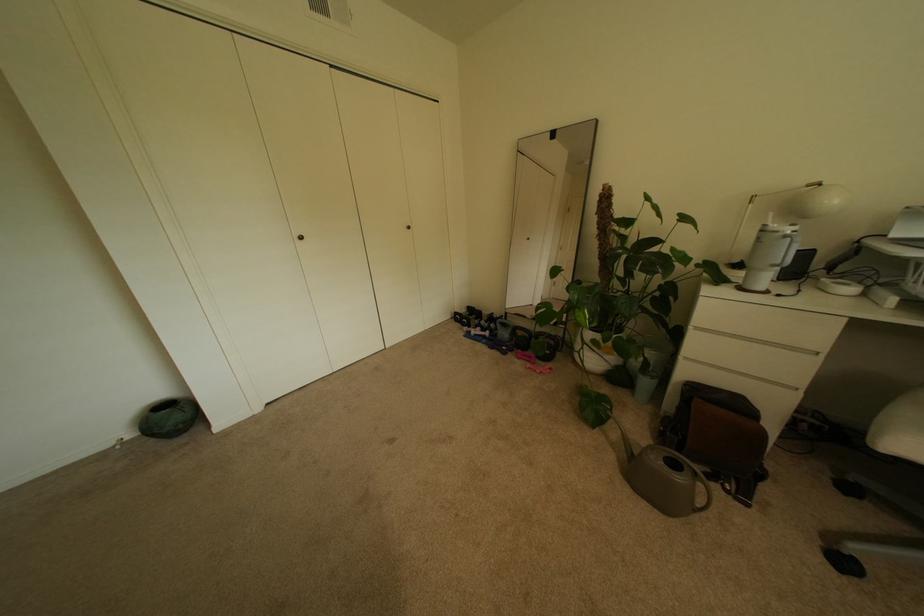
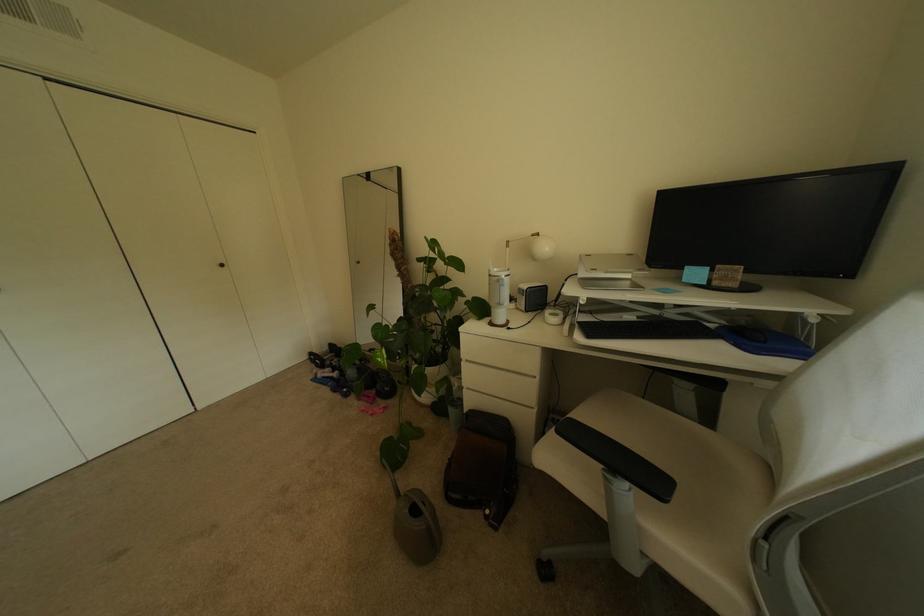
Question: How did the camera likely rotate?

Choices:
 (A) Left
 (B) Right
 (C) Up
 (D) Down

Answer: (B)